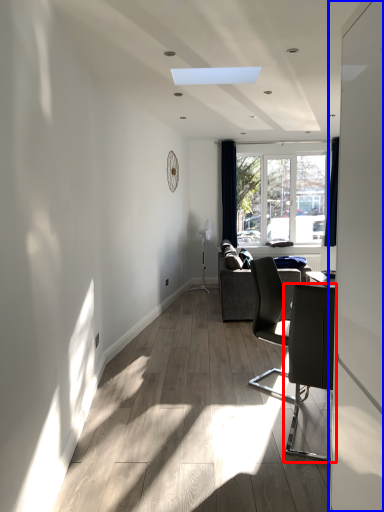
Question: Which of the following is the closest to the observer, chair (highlighted by a red box) or screen door (highlighted by a blue box)?

Choices:
 (A) chair
 (B) screen door

Answer: (B)